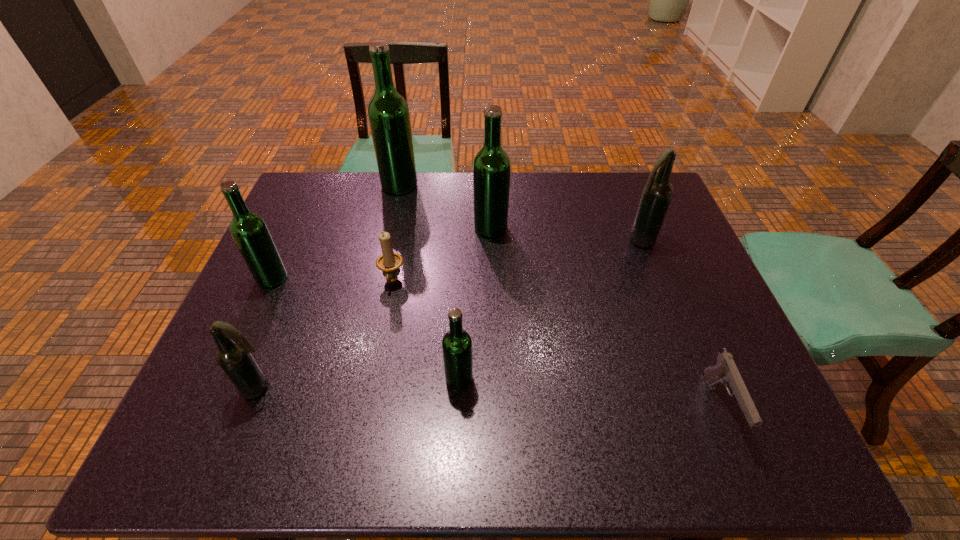
Find the location of a particular element. This screenshot has width=960, height=540. object at the far edge is located at coordinates (x=388, y=112).

This screenshot has height=540, width=960. Identify the location of object that is at the near edge. (725, 371).

Locate an element on the screen. Image resolution: width=960 pixels, height=540 pixels. beer bottle positioned at the right edge is located at coordinates (657, 193).

The height and width of the screenshot is (540, 960). I want to click on pistol that is positioned at the right edge, so click(x=725, y=371).

Locate an element on the screen. This screenshot has height=540, width=960. object situated at the near right corner is located at coordinates [x=725, y=371].

In the image, there is a desktop. At what (x,y) coordinates should I click in order to perform the action: click on vacant area at the near edge. Please return your answer as a coordinate pair (x, y). This screenshot has height=540, width=960. Looking at the image, I should click on (337, 450).

I want to click on blank area at the left edge, so tap(285, 254).

Locate an element on the screen. This screenshot has width=960, height=540. vacant region at the right edge of the desktop is located at coordinates (662, 314).

At what (x,y) coordinates should I click in order to perform the action: click on empty space that is in between the fourth farthest beer bottle and the right dark beer bottle. Please return your answer as a coordinate pair (x, y). This screenshot has height=540, width=960. Looking at the image, I should click on (455, 259).

Locate an element on the screen. vacant space in between the nearest green beer bottle and the second biggest green beer bottle is located at coordinates (475, 303).